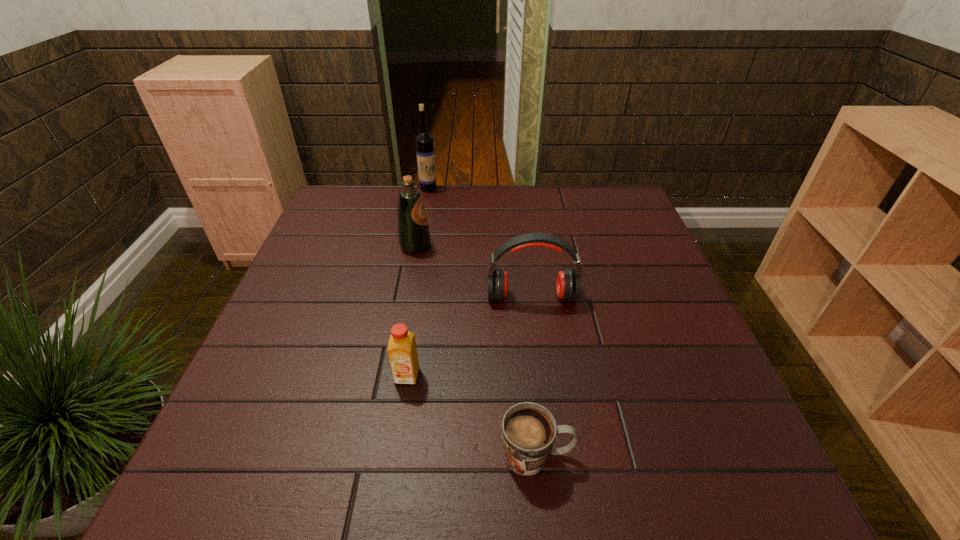
You are a GUI agent. You are given a task and a screenshot of the screen. Output one action in this format:
    pyautogui.click(x=<x>, y=<y>)
    Task: Click on the free space located on the label of the farthest object
    This screenshot has width=960, height=540.
    Given the screenshot: What is the action you would take?
    pyautogui.click(x=424, y=211)

Identify the location of vacant region located on the front-facing side of the olive oil. (492, 246).

Identify the location of free spot located 0.310m on the ear cups of the earphone. (548, 424).

The height and width of the screenshot is (540, 960). Identify the location of vacant space situated 0.220m on the front and back of the fourth tallest object. (389, 499).

You are a GUI agent. You are given a task and a screenshot of the screen. Output one action in this format:
    pyautogui.click(x=<x>, y=<y>)
    Task: Click on the free space located on the side of the shortest object with the handle
    
    Given the screenshot: What is the action you would take?
    pyautogui.click(x=720, y=455)

At what (x,y) coordinates should I click in order to perform the action: click on object that is at the far edge. Please return your answer as a coordinate pair (x, y). Image resolution: width=960 pixels, height=540 pixels. Looking at the image, I should click on point(425,152).

I want to click on object that is at the near edge, so click(x=528, y=429).

The width and height of the screenshot is (960, 540). Identify the location of vacant region at the far edge of the desktop. (451, 219).

Where is `vacant space at the near edge`? This screenshot has width=960, height=540. vacant space at the near edge is located at coordinates (408, 477).

In order to click on vacant space at the left edge in this screenshot , I will do `click(266, 363)`.